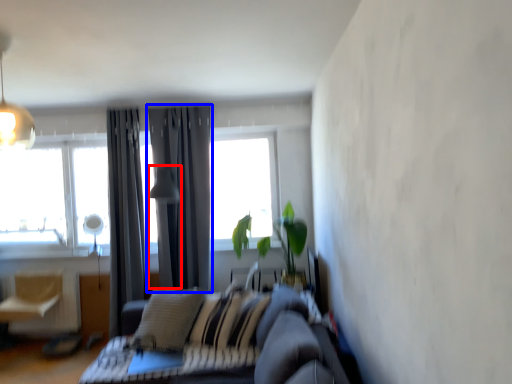
Question: Which point is further to the camera, light fixture (highlighted by a red box) or curtain (highlighted by a blue box)?

Choices:
 (A) light fixture
 (B) curtain

Answer: (B)